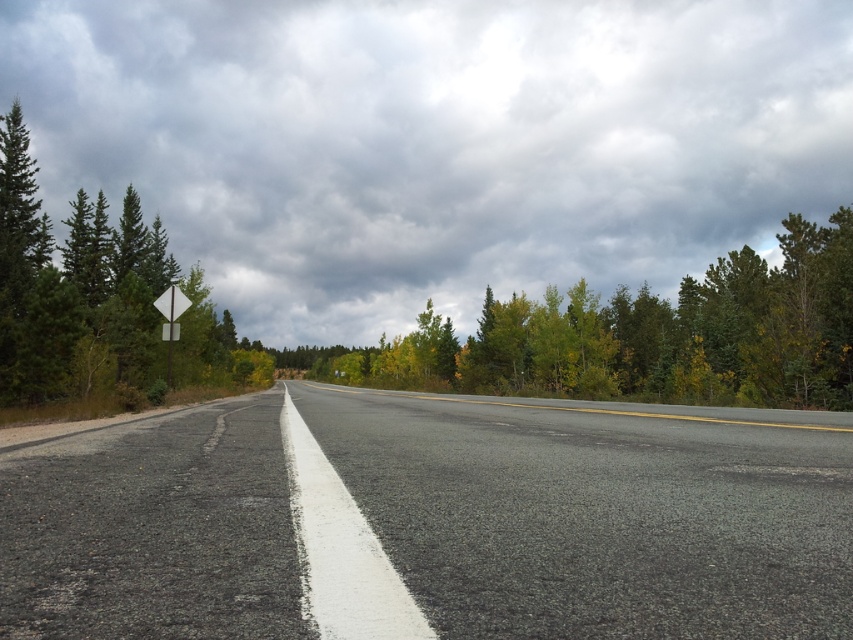
You are driving a car that is 2 meters long. You want to park your car on the asphalt road at center without crossing the yellow solid lines on the edges. Is there enough space?

The asphalt road at center is 2.71 meters wide. Since your car is 2 meters long, there is enough space to park without crossing the yellow solid lines on the edges.